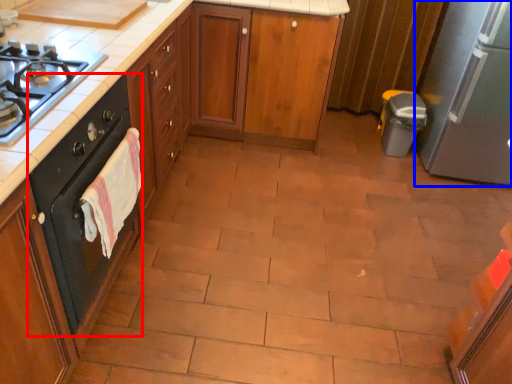
Question: Among these objects, which one is farthest to the camera, home appliance (highlighted by a red box) or kitchen appliance (highlighted by a blue box)?

Choices:
 (A) home appliance
 (B) kitchen appliance

Answer: (B)